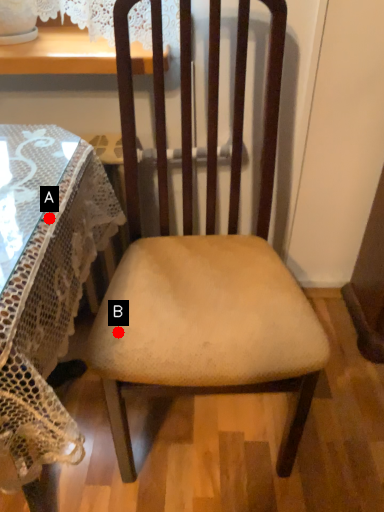
Question: Two points are circled on the image, labeled by A and B beside each circle. Which of the following is the closest to the observer?

Choices:
 (A) A is closer
 (B) B is closer

Answer: (A)